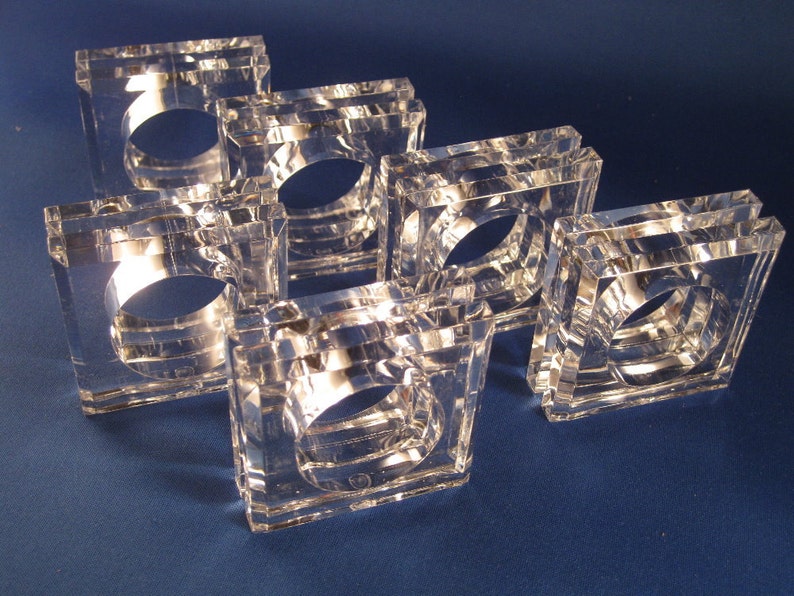
This screenshot has height=596, width=794. I want to click on blue cloth, so click(559, 496).